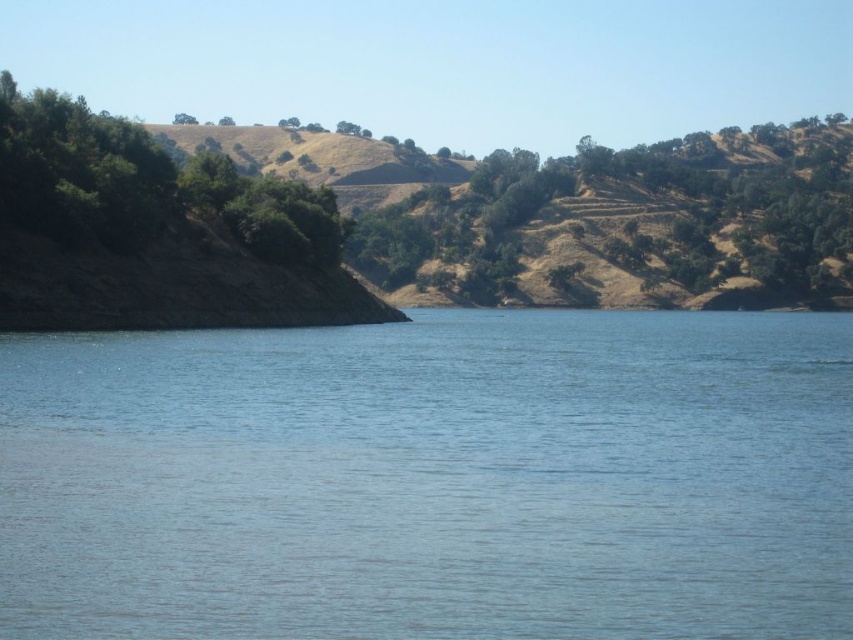
Question: Does blue water at center appear under dry grassy hillside at upper center?

Choices:
 (A) yes
 (B) no

Answer: (A)

Question: Is the position of dry grassy hillside at upper center less distant than that of green leafy tree at upper center?

Choices:
 (A) yes
 (B) no

Answer: (A)

Question: Which is nearer to the blue water at center?

Choices:
 (A) dry grassy hillside at upper center
 (B) green leafy tree at upper center

Answer: (A)

Question: Which point is farther to the camera?

Choices:
 (A) dry grassy hillside at upper center
 (B) green leafy tree at upper center

Answer: (B)

Question: Is dry grassy hillside at upper center above green leafy tree at upper center?

Choices:
 (A) no
 (B) yes

Answer: (A)

Question: Estimate the real-world distances between objects in this image. Which object is farther from the dry grassy hillside at upper center?

Choices:
 (A) blue water at center
 (B) green leafy tree at upper center

Answer: (A)